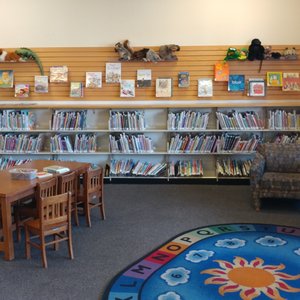
The image size is (300, 300). What are the coordinates of `table leg` in the screenshot? It's located at (9, 224).